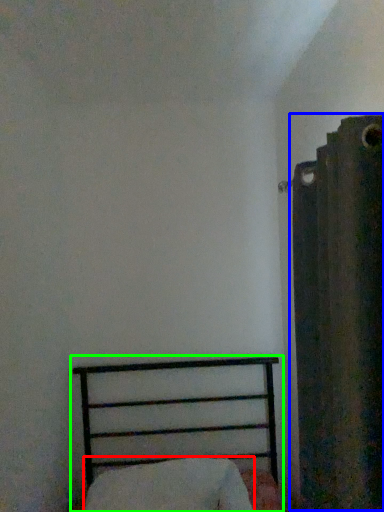
Question: Considering the real-world distances, which object is farthest from pillow (highlighted by a red box)? curtain (highlighted by a blue box) or bed (highlighted by a green box)?

Choices:
 (A) curtain
 (B) bed

Answer: (A)